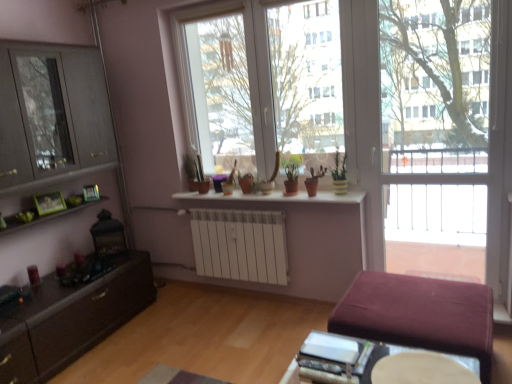
Question: Is matte brown pot at center, arranged as the fourth houseplant when viewed from the right, positioned behind green matte plant at center, which is the first houseplant from right to left?

Choices:
 (A) yes
 (B) no

Answer: (A)

Question: Is matte brown pot at center, arranged as the fourth houseplant when viewed from the right, thinner than green matte plant at center, which is the first houseplant from right to left?

Choices:
 (A) yes
 (B) no

Answer: (B)

Question: Does matte brown pot at center, the 1th houseplant positioned from the left, have a greater height compared to green matte plant at center, the fourth houseplant from the left?

Choices:
 (A) yes
 (B) no

Answer: (B)

Question: Considering the relative sizes of matte brown pot at center, arranged as the fourth houseplant when viewed from the right, and green matte plant at center, the fourth houseplant from the left, in the image provided, is matte brown pot at center, arranged as the fourth houseplant when viewed from the right, shorter than green matte plant at center, the fourth houseplant from the left,?

Choices:
 (A) yes
 (B) no

Answer: (A)

Question: Does matte brown pot at center, arranged as the fourth houseplant when viewed from the right, appear on the left side of green matte plant at center, which is the first houseplant from right to left?

Choices:
 (A) yes
 (B) no

Answer: (A)

Question: Considering the positions of green matte picture frame at left, arranged as the first picture frame when viewed from the front, and light brown wooden table at lower center in the image, is green matte picture frame at left, arranged as the first picture frame when viewed from the front, bigger or smaller than light brown wooden table at lower center?

Choices:
 (A) small
 (B) big

Answer: (B)

Question: Does point (41, 196) appear closer or farther from the camera than point (446, 379)?

Choices:
 (A) closer
 (B) farther

Answer: (B)

Question: From the image's perspective, is green matte picture frame at left, which is counted as the second picture frame, starting from the back, above or below light brown wooden table at lower center?

Choices:
 (A) below
 (B) above

Answer: (B)

Question: Is green matte picture frame at left, the first picture frame from the left, in front of or behind light brown wooden table at lower center in the image?

Choices:
 (A) behind
 (B) front

Answer: (A)

Question: From a real-world perspective, is velvet maroon ottoman at lower right physically located above or below matte brown pot at center, positioned as the 2th houseplant in right-to-left order?

Choices:
 (A) below
 (B) above

Answer: (A)

Question: Is velvet maroon ottoman at lower right in front of or behind matte brown pot at center, positioned as the 2th houseplant in right-to-left order, in the image?

Choices:
 (A) front
 (B) behind

Answer: (A)

Question: Considering the positions of velvet maroon ottoman at lower right and matte brown pot at center, positioned as the 2th houseplant in right-to-left order, in the image, is velvet maroon ottoman at lower right wider or thinner than matte brown pot at center, positioned as the 2th houseplant in right-to-left order,?

Choices:
 (A) wide
 (B) thin

Answer: (A)

Question: Considering the positions of point (480, 375) and point (323, 168), is point (480, 375) closer or farther from the camera than point (323, 168)?

Choices:
 (A) closer
 (B) farther

Answer: (A)

Question: Based on their sizes in the image, would you say green matte picture frame at left, which is the second picture frame from right to left, is bigger or smaller than transparent glass screen door at right?

Choices:
 (A) small
 (B) big

Answer: (A)

Question: Is green matte picture frame at left, the first picture frame from the left, inside the boundaries of transparent glass screen door at right, or outside?

Choices:
 (A) outside
 (B) inside

Answer: (A)